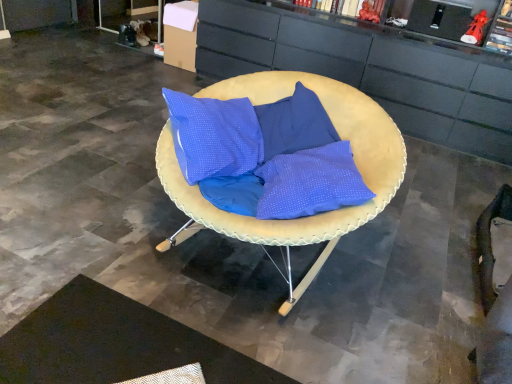
Question: Is matte black cabinet at center at the left side of black textured mat at lower left?

Choices:
 (A) yes
 (B) no

Answer: (B)

Question: Can you confirm if matte black cabinet at center is thinner than black textured mat at lower left?

Choices:
 (A) yes
 (B) no

Answer: (B)

Question: Does matte black cabinet at center touch black textured mat at lower left?

Choices:
 (A) yes
 (B) no

Answer: (B)

Question: Is the depth of matte black cabinet at center greater than that of black textured mat at lower left?

Choices:
 (A) no
 (B) yes

Answer: (B)

Question: Can you confirm if matte black cabinet at center is wider than black textured mat at lower left?

Choices:
 (A) yes
 (B) no

Answer: (A)

Question: From the image's perspective, is matte yellow cushion at center positioned above or below matte black cabinet at center?

Choices:
 (A) below
 (B) above

Answer: (A)

Question: In the image, is matte yellow cushion at center positioned in front of or behind matte black cabinet at center?

Choices:
 (A) front
 (B) behind

Answer: (A)

Question: From a real-world perspective, is matte yellow cushion at center above or below matte black cabinet at center?

Choices:
 (A) below
 (B) above

Answer: (A)

Question: In terms of height, does matte yellow cushion at center look taller or shorter compared to matte black cabinet at center?

Choices:
 (A) tall
 (B) short

Answer: (B)

Question: Is matte yellow cushion at center to the left or to the right of black textured mat at lower left in the image?

Choices:
 (A) right
 (B) left

Answer: (A)

Question: Is matte yellow cushion at center in front of or behind black textured mat at lower left in the image?

Choices:
 (A) front
 (B) behind

Answer: (B)

Question: Which is correct: matte yellow cushion at center is inside black textured mat at lower left, or outside of it?

Choices:
 (A) inside
 (B) outside

Answer: (B)

Question: Is matte yellow cushion at center taller or shorter than black textured mat at lower left?

Choices:
 (A) tall
 (B) short

Answer: (A)

Question: Looking at the image, does matte black cabinet at center seem bigger or smaller compared to black textured mat at lower left?

Choices:
 (A) big
 (B) small

Answer: (A)

Question: From a real-world perspective, is matte black cabinet at center above or below black textured mat at lower left?

Choices:
 (A) below
 (B) above

Answer: (B)